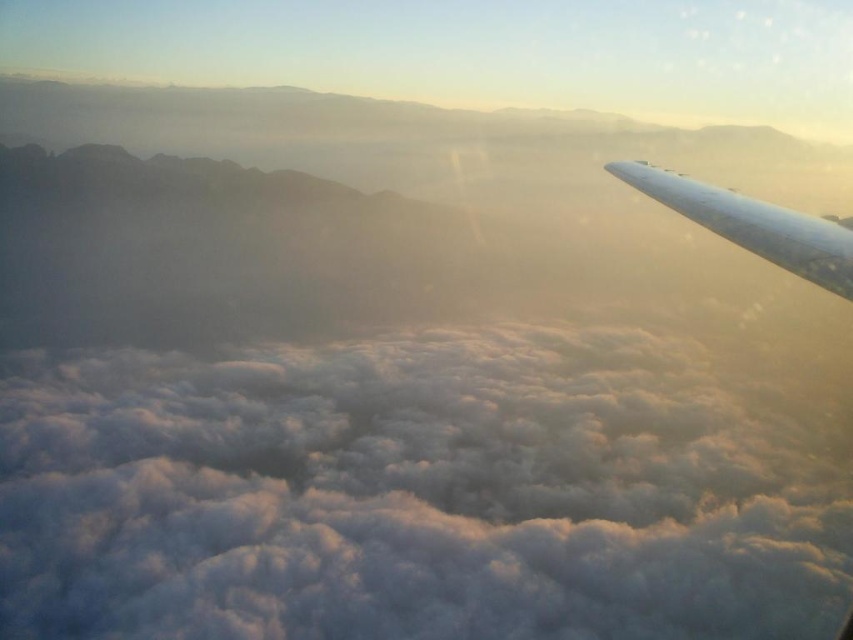
You are a pilot flying an airplane. You notice a white fluffy cloud at center and a white glossy wing at upper right. Which object is positioned higher in the sky?

The white glossy wing at upper right is positioned higher in the sky than the white fluffy cloud at center, as it is located above it.

You are a pilot flying an airplane with a wingspan of 30 meters. You notice a white fluffy cloud at center and a white glossy wing at upper right. Which object is wider? Please determine based on the description provided.

The white fluffy cloud at center is wider than the white glossy wing at upper right according to the description.

In the scene shown: You are a pilot flying an airplane and you notice the white fluffy cloud at center and the white glossy wing at upper right. Which object is closer to the left side of the airplane window?

The white fluffy cloud at center is closer to the left side of the airplane window because it is positioned to the left of the white glossy wing at upper right.